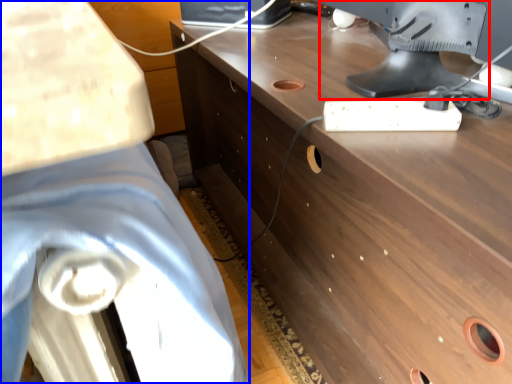
Question: Which object is further to the camera taking this photo, computer monitor (highlighted by a red box) or swivel chair (highlighted by a blue box)?

Choices:
 (A) computer monitor
 (B) swivel chair

Answer: (A)